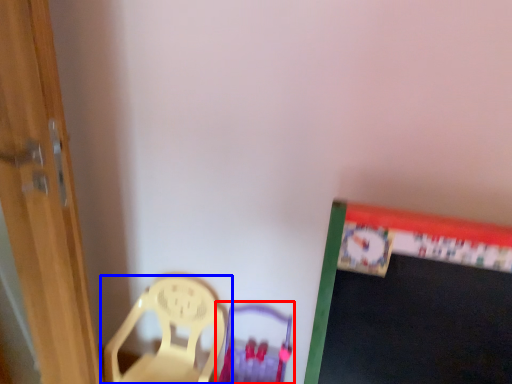
Question: Which object appears closest to the camera in this image, armchair (highlighted by a red box) or chair (highlighted by a blue box)?

Choices:
 (A) armchair
 (B) chair

Answer: (A)